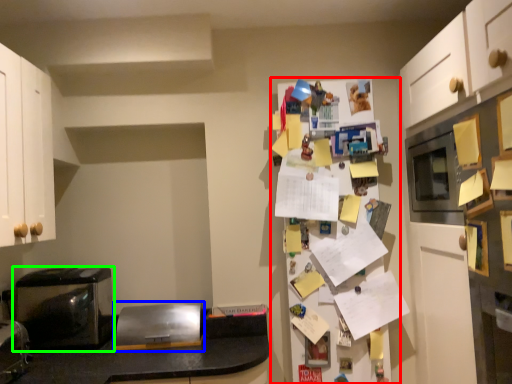
Question: Considering the real-world distances, which object is farthest from fridge (highlighted by a red box)? appliance (highlighted by a blue box) or home appliance (highlighted by a green box)?

Choices:
 (A) appliance
 (B) home appliance

Answer: (B)